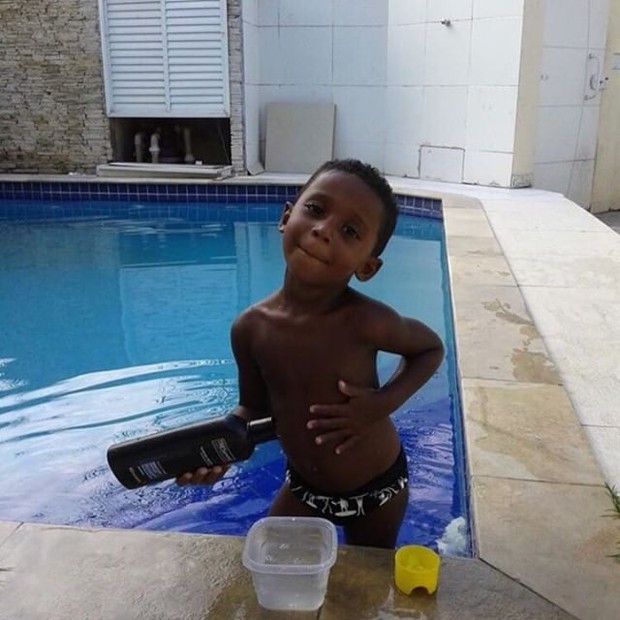
The image size is (620, 620). Identify the location of door. (578, 92).